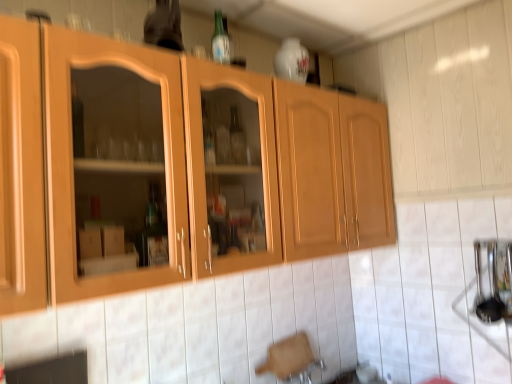
Question: Would you say matte glass bottle at upper center is outside wooden cabinet at center?

Choices:
 (A) no
 (B) yes

Answer: (B)

Question: Can you confirm if matte glass bottle at upper center is smaller than wooden cabinet at center?

Choices:
 (A) no
 (B) yes

Answer: (B)

Question: From a real-world perspective, is matte glass bottle at upper center located beneath wooden cabinet at center?

Choices:
 (A) yes
 (B) no

Answer: (B)

Question: Is matte glass bottle at upper center to the left of wooden cabinet at center from the viewer's perspective?

Choices:
 (A) no
 (B) yes

Answer: (B)

Question: From a real-world perspective, is matte glass bottle at upper center on top of wooden cabinet at center?

Choices:
 (A) yes
 (B) no

Answer: (A)

Question: Is matte glass bottle at upper center looking in the opposite direction of wooden cabinet at center?

Choices:
 (A) yes
 (B) no

Answer: (B)

Question: Is wooden cabinet at center not inside matte glass bottle at upper center?

Choices:
 (A) no
 (B) yes

Answer: (B)

Question: Is wooden cabinet at center to the left of matte glass bottle at upper center from the viewer's perspective?

Choices:
 (A) no
 (B) yes

Answer: (A)

Question: Can you confirm if wooden cabinet at center is shorter than matte glass bottle at upper center?

Choices:
 (A) yes
 (B) no

Answer: (B)

Question: Are wooden cabinet at center and matte glass bottle at upper center making contact?

Choices:
 (A) no
 (B) yes

Answer: (A)

Question: Is wooden cabinet at center smaller than matte glass bottle at upper center?

Choices:
 (A) yes
 (B) no

Answer: (B)

Question: Is wooden cabinet at center far away from matte glass bottle at upper center?

Choices:
 (A) no
 (B) yes

Answer: (A)

Question: Does point (158, 41) appear closer or farther from the camera than point (86, 281)?

Choices:
 (A) closer
 (B) farther

Answer: (B)